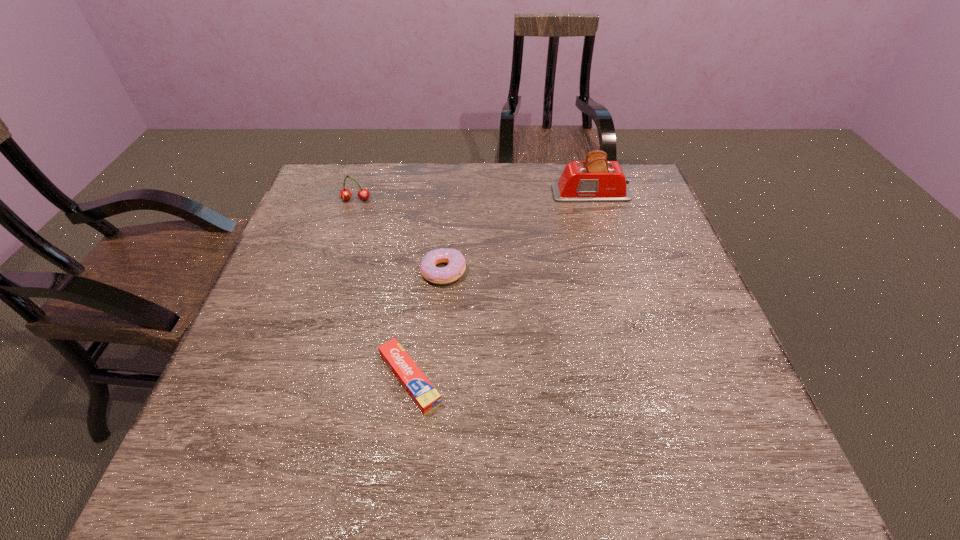
In order to click on the rightmost object in this screenshot , I will do `click(595, 180)`.

Image resolution: width=960 pixels, height=540 pixels. In order to click on toaster in this screenshot , I will do `click(595, 180)`.

Locate an element on the screen. The width and height of the screenshot is (960, 540). the leftmost object is located at coordinates (345, 194).

Where is `the second tallest object`? The width and height of the screenshot is (960, 540). the second tallest object is located at coordinates (345, 194).

I want to click on the third tallest object, so click(x=456, y=266).

Identify the location of the third farthest object. (456, 266).

The image size is (960, 540). I want to click on the shortest object, so click(423, 393).

At what (x,y) coordinates should I click in order to perform the action: click on the nearest object. Please return your answer as a coordinate pair (x, y). Image resolution: width=960 pixels, height=540 pixels. Looking at the image, I should click on (423, 393).

Where is `vacant space located on the front of the tallest object`? vacant space located on the front of the tallest object is located at coordinates (600, 224).

I want to click on vacant space located with stems pointing upwards on the second tallest object, so pyautogui.click(x=340, y=247).